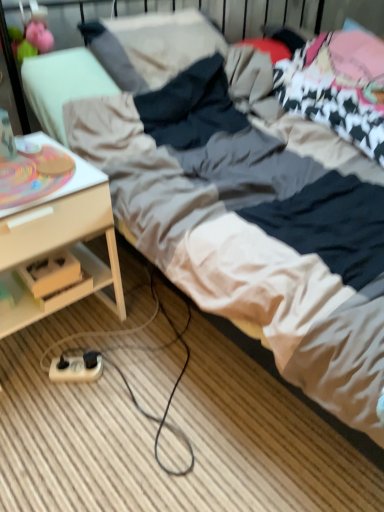
Question: Is point (96, 190) positioned closer to the camera than point (56, 374)?

Choices:
 (A) farther
 (B) closer

Answer: (B)

Question: From a real-world perspective, is white wood desk at lower left positioned above or below beige plastic extension cord at lower left?

Choices:
 (A) above
 (B) below

Answer: (A)

Question: Relative to beige plastic extension cord at lower left, is white wood desk at lower left in front or behind?

Choices:
 (A) front
 (B) behind

Answer: (A)

Question: Considering the relative positions of beige plastic extension cord at lower left and white wood desk at lower left in the image provided, is beige plastic extension cord at lower left to the left or to the right of white wood desk at lower left?

Choices:
 (A) left
 (B) right

Answer: (B)

Question: Is point (79, 371) positioned closer to the camera than point (94, 193)?

Choices:
 (A) farther
 (B) closer

Answer: (A)

Question: From a real-world perspective, relative to white wood desk at lower left, is beige plastic extension cord at lower left vertically above or below?

Choices:
 (A) above
 (B) below

Answer: (B)

Question: Considering their positions, is beige plastic extension cord at lower left located in front of or behind white wood desk at lower left?

Choices:
 (A) front
 (B) behind

Answer: (B)